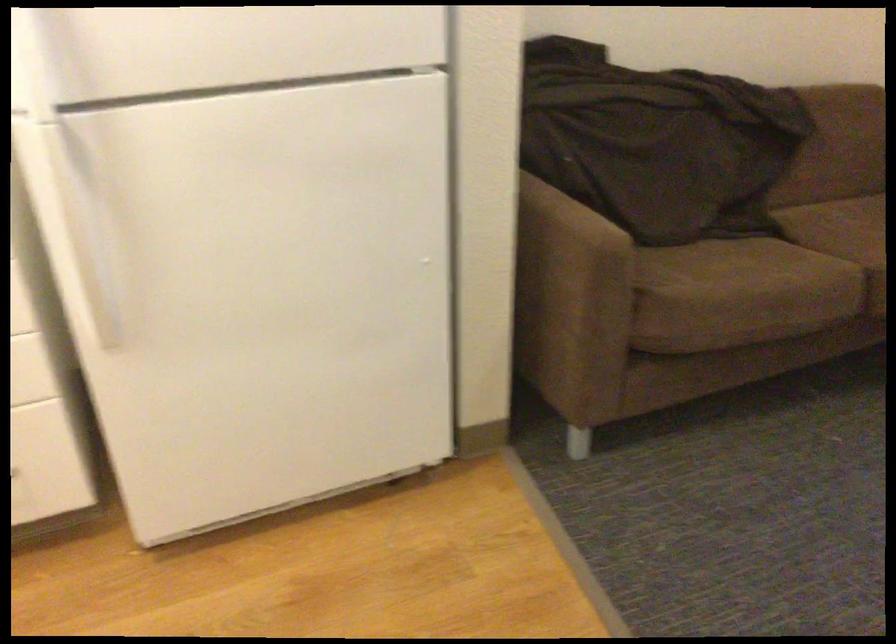
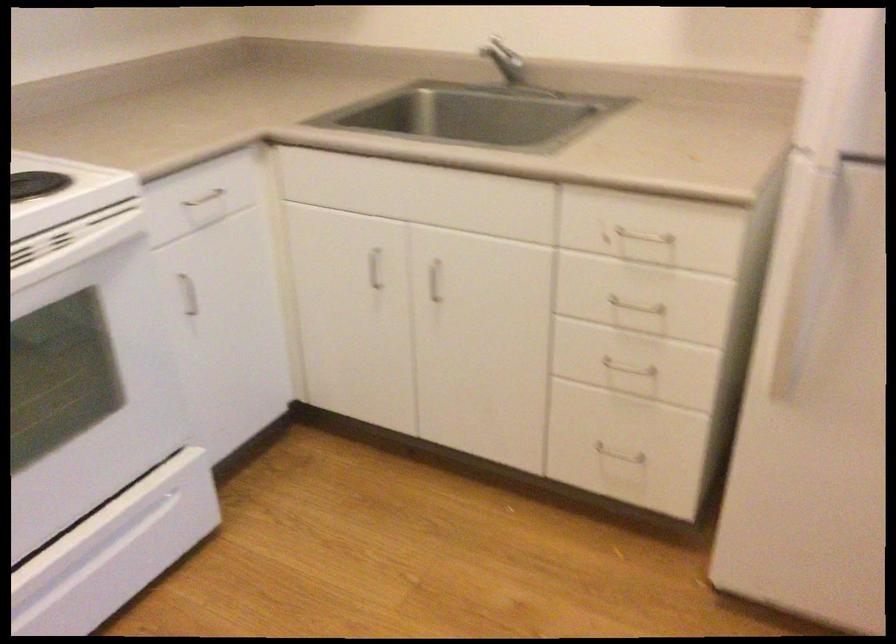
Question: The camera is either moving clockwise (left) or counter-clockwise (right) around the object. The first image is from the beginning of the video and the second image is from the end. Is the camera moving left or right when shooting the video?

Choices:
 (A) Left
 (B) Right

Answer: (B)